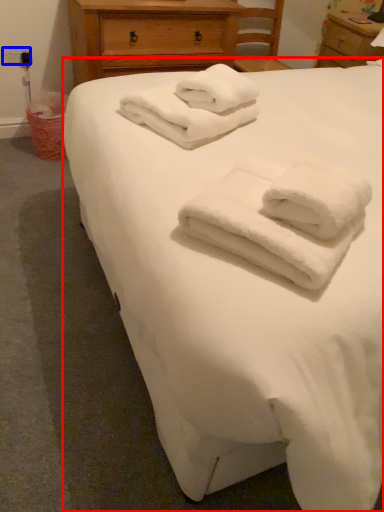
Question: Which object is further to the camera taking this photo, bed (highlighted by a red box) or electric outlet (highlighted by a blue box)?

Choices:
 (A) bed
 (B) electric outlet

Answer: (B)